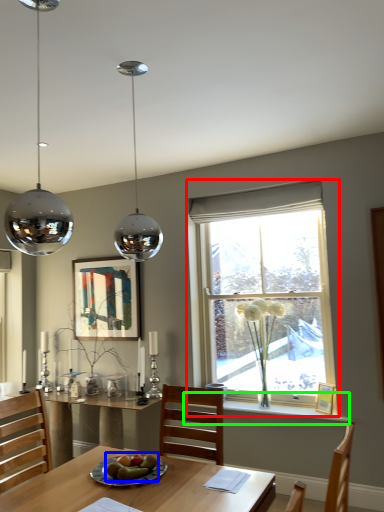
Question: Considering the real-world distances, which object is closest to window (highlighted by a red box)? food (highlighted by a blue box) or window sill (highlighted by a green box).

Choices:
 (A) food
 (B) window sill

Answer: (B)